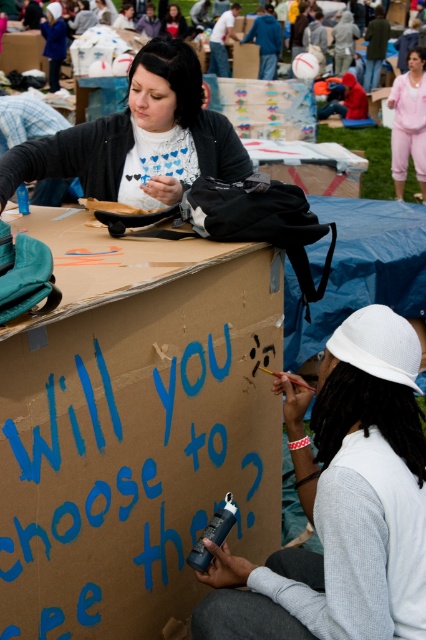
You are standing in front of the cardboard box and want to reach both points marked on it. Which point, point [28,580] or point [397,173], is closer to you?

Point [28,580] is closer to the viewer than point [397,173], so you can reach it first.

You are a photographer at this event and want to focus on the white matte sweater at upper center and the matte black shirt at upper center. Which one is positioned closer to the camera?

The white matte sweater at upper center is closer to the viewer than the matte black shirt at upper center, so the camera would focus on it first.

You are a photographer at the event and want to capture a clear photo of the blue cardboard box at center and the white mesh hat at upper right. However, the box is blocking part of the hat. Can you adjust your position to see both objects without any obstruction?

The blue cardboard box at center is positioned over the white mesh hat at upper right, so moving your camera angle slightly downward or to the side should allow you to capture both objects without obstruction.